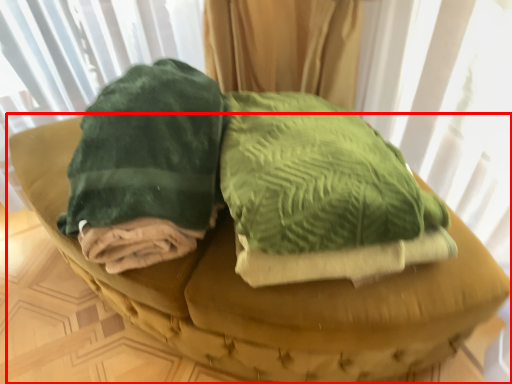
Question: From the image's perspective, considering the relative positions of furniture (annotated by the red box) and cloth in the image provided, where is furniture (annotated by the red box) located with respect to the staircase?

Choices:
 (A) above
 (B) below

Answer: (B)